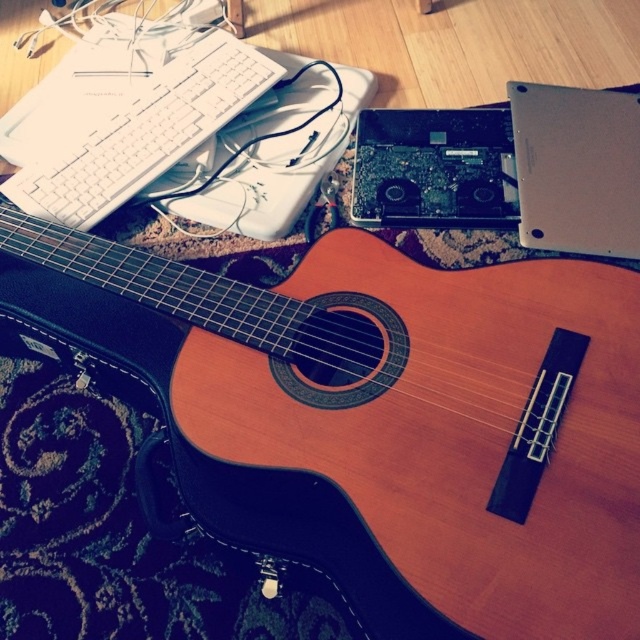
Question: Estimate the real-world distances between objects in this image. Which object is closer to the natural wood acoustic guitar at center?

Choices:
 (A) silver metallic laptop at upper right
 (B) black plastic laptop at upper center
 (C) white plastic keyboard at upper left

Answer: (B)

Question: Does white plastic keyboard at upper left lie in front of black plastic laptop at upper center?

Choices:
 (A) no
 (B) yes

Answer: (A)

Question: Which is nearer to the white plastic keyboard at upper left?

Choices:
 (A) natural wood acoustic guitar at center
 (B) silver metallic laptop at upper right

Answer: (A)

Question: In this image, where is silver metallic laptop at upper right located relative to black plastic laptop at upper center?

Choices:
 (A) right
 (B) left

Answer: (A)

Question: Is white plastic keyboard at upper left to the right of silver metallic laptop at upper right from the viewer's perspective?

Choices:
 (A) yes
 (B) no

Answer: (B)

Question: Which of the following is the farthest from the observer?

Choices:
 (A) (4, 182)
 (B) (636, 168)
 (C) (365, 620)

Answer: (A)